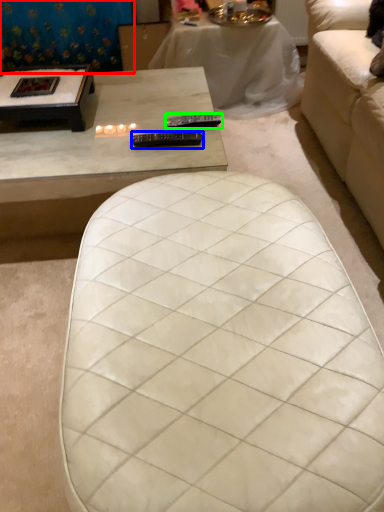
Question: Which object is positioned closest to curtain (highlighted by a red box)? Select from remote (highlighted by a blue box) and remote (highlighted by a green box).

Choices:
 (A) remote
 (B) remote

Answer: (B)